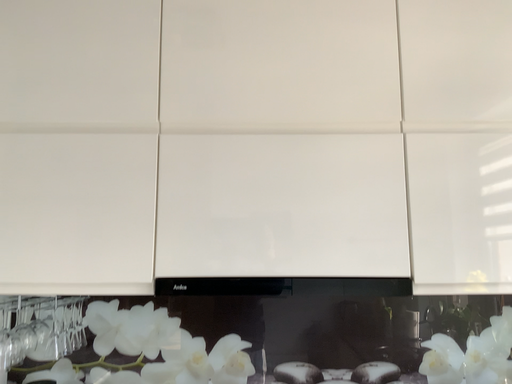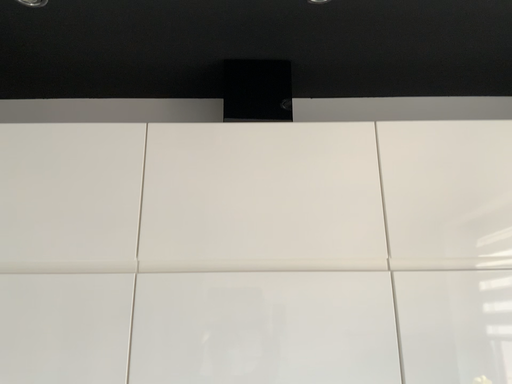
Question: Which way did the camera rotate in the video?

Choices:
 (A) rotated downward
 (B) rotated upward

Answer: (B)